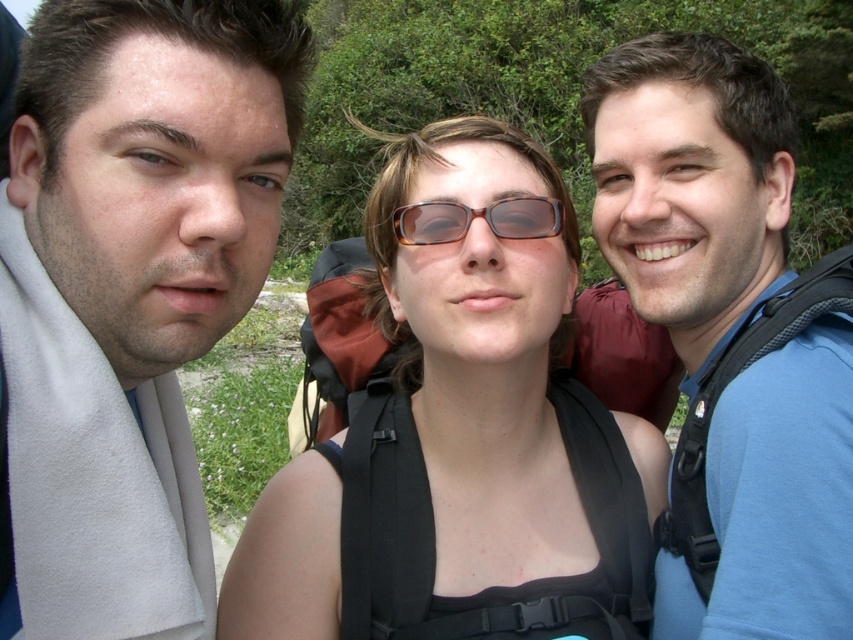
Is blue fabric backpack at center shorter than tortoiseshell plastic glasses at center?

No.

Is point (746, 152) positioned after point (560, 227)?

Yes, it is behind point (560, 227).

The width and height of the screenshot is (853, 640). What are the coordinates of `blue fabric backpack at center` in the screenshot? It's located at (689, 184).

This screenshot has height=640, width=853. Find the location of `blue fabric backpack at center`. blue fabric backpack at center is located at coordinates (689, 184).

Can you confirm if blue fabric backpack at center is smaller than matte black backpack at center?

Yes.

Between point (822, 417) and point (329, 600), which one is positioned in front?

Positioned in front is point (822, 417).

Locate an element on the screen. blue fabric backpack at center is located at coordinates (689, 184).

Who is positioned more to the left, smooth gray towel at left or blue fabric backpack at center?

Positioned to the left is smooth gray towel at left.

Measure the distance from smooth gray towel at left to blue fabric backpack at center.

32.11 inches

In order to click on smooth gray towel at left in this screenshot , I will do `click(129, 292)`.